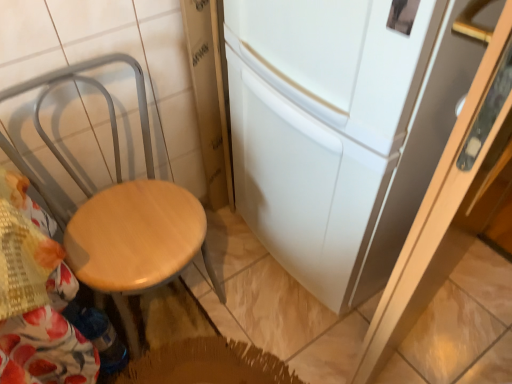
Question: Considering the relative sizes of white matte refrigerator at center and wooden seat at left in the image provided, is white matte refrigerator at center shorter than wooden seat at left?

Choices:
 (A) yes
 (B) no

Answer: (B)

Question: From the image's perspective, does white matte refrigerator at center appear lower than wooden seat at left?

Choices:
 (A) no
 (B) yes

Answer: (A)

Question: Is white matte refrigerator at center facing towards wooden seat at left?

Choices:
 (A) no
 (B) yes

Answer: (B)

Question: Does white matte refrigerator at center have a larger size compared to wooden seat at left?

Choices:
 (A) no
 (B) yes

Answer: (B)

Question: Is white matte refrigerator at center to the left of wooden seat at left from the viewer's perspective?

Choices:
 (A) yes
 (B) no

Answer: (B)

Question: Considering the relative sizes of white matte refrigerator at center and wooden seat at left in the image provided, is white matte refrigerator at center wider than wooden seat at left?

Choices:
 (A) no
 (B) yes

Answer: (B)

Question: Can you confirm if wooden seat at left is taller than white matte refrigerator at center?

Choices:
 (A) yes
 (B) no

Answer: (B)

Question: Does wooden seat at left appear on the right side of white matte refrigerator at center?

Choices:
 (A) yes
 (B) no

Answer: (B)

Question: Does wooden seat at left appear on the left side of white matte refrigerator at center?

Choices:
 (A) no
 (B) yes

Answer: (B)

Question: Is wooden seat at left turned away from white matte refrigerator at center?

Choices:
 (A) yes
 (B) no

Answer: (B)

Question: Are wooden seat at left and white matte refrigerator at center making contact?

Choices:
 (A) yes
 (B) no

Answer: (B)

Question: Is wooden seat at left surrounding white matte refrigerator at center?

Choices:
 (A) no
 (B) yes

Answer: (A)

Question: Is white matte refrigerator at center bigger or smaller than wooden seat at left?

Choices:
 (A) big
 (B) small

Answer: (A)